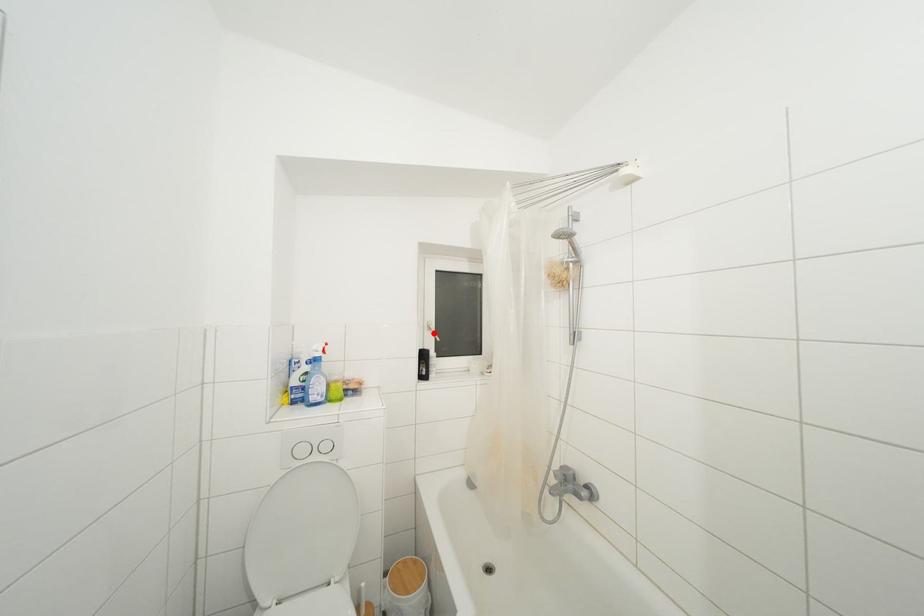
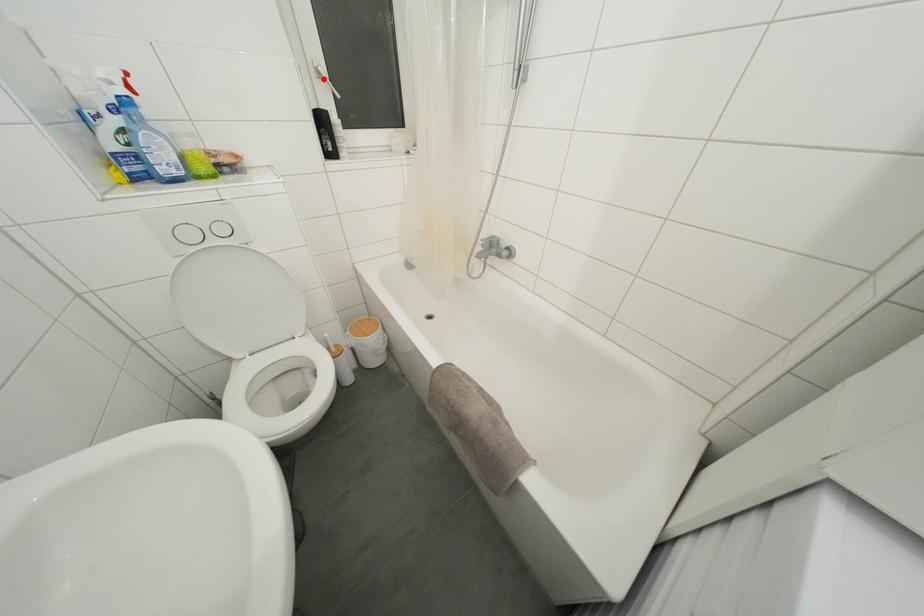
I am providing you with two images of the same scene from different viewpoints. A red point is marked on the first image and another point is marked on the second image. Is the red point in image1 aligned with the point shown in image2?

Yes